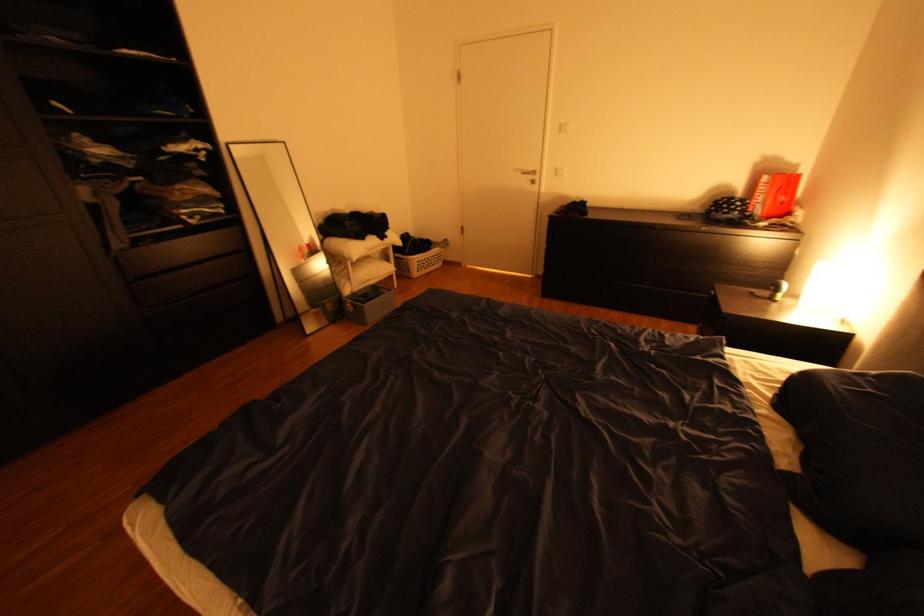
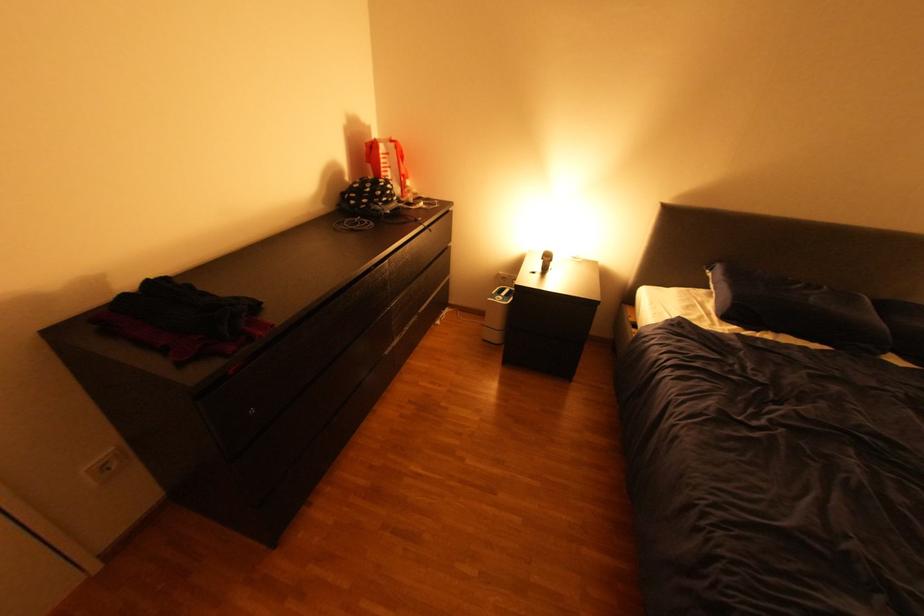
Locate, in the second image, the point that corresponds to point 779,395 in the first image.

(745, 326)